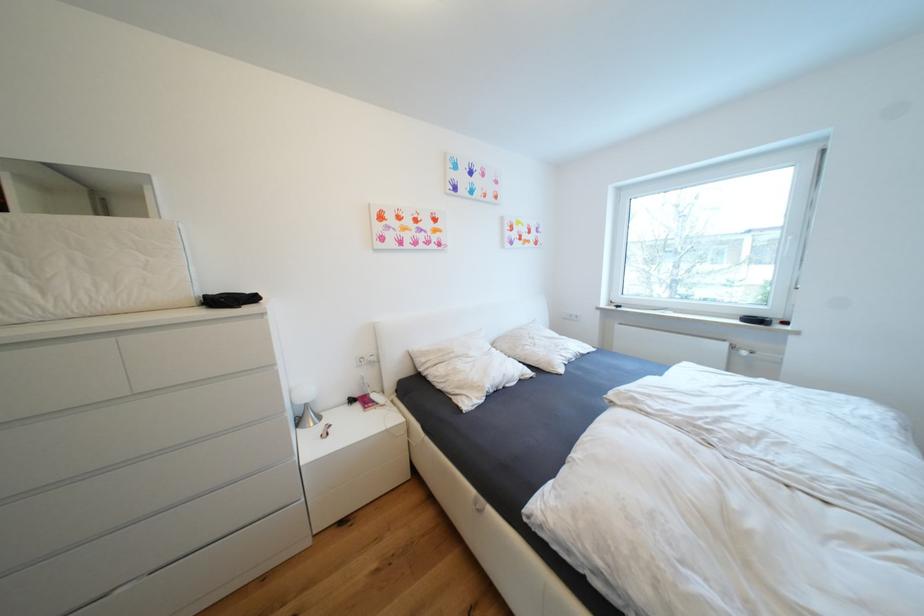
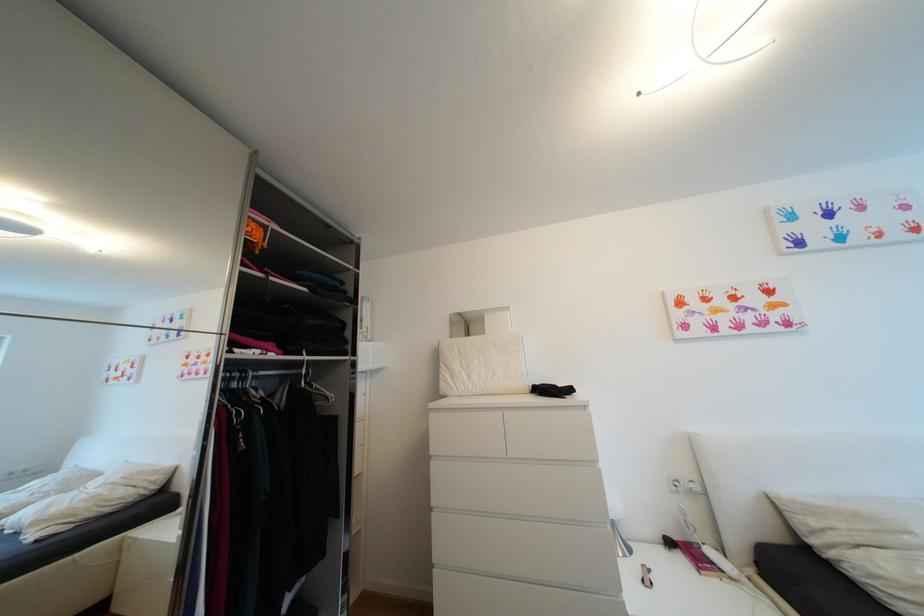
The first image is from the beginning of the video and the second image is from the end. How did the camera likely rotate when shooting the video?

The camera rotated toward left-up.